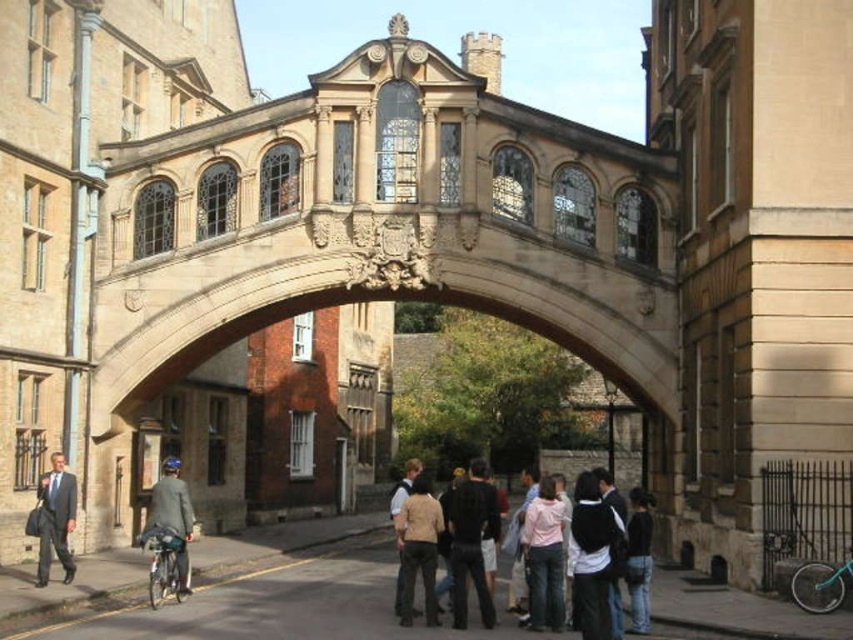
Is light brown leather jacket at lower center to the right of matte black suit at left from the viewer's perspective?

Correct, you'll find light brown leather jacket at lower center to the right of matte black suit at left.

Between point (407, 508) and point (65, 532), which one is positioned in front?

Point (407, 508)

This screenshot has height=640, width=853. I want to click on light brown leather jacket at lower center, so click(x=447, y=547).

Does beige stone bridge at center have a lesser height compared to matte gray suit at lower left?

Incorrect, beige stone bridge at center's height does not fall short of matte gray suit at lower left's.

Can you confirm if beige stone bridge at center is bigger than matte gray suit at lower left?

Yes.

Locate an element on the screen. This screenshot has width=853, height=640. beige stone bridge at center is located at coordinates (381, 225).

At what (x,y) coordinates should I click in order to perform the action: click on beige stone bridge at center. Please return your answer as a coordinate pair (x, y). Looking at the image, I should click on (381, 225).

How much distance is there between matte gray suit at lower left and matte black suit at left?

matte gray suit at lower left and matte black suit at left are 6.92 meters apart.

Is matte gray suit at lower left bigger than matte black suit at left?

Correct, matte gray suit at lower left is larger in size than matte black suit at left.

Between point (189, 515) and point (53, 518), which one is positioned behind?

Positioned behind is point (53, 518).

I want to click on matte gray suit at lower left, so click(171, 518).